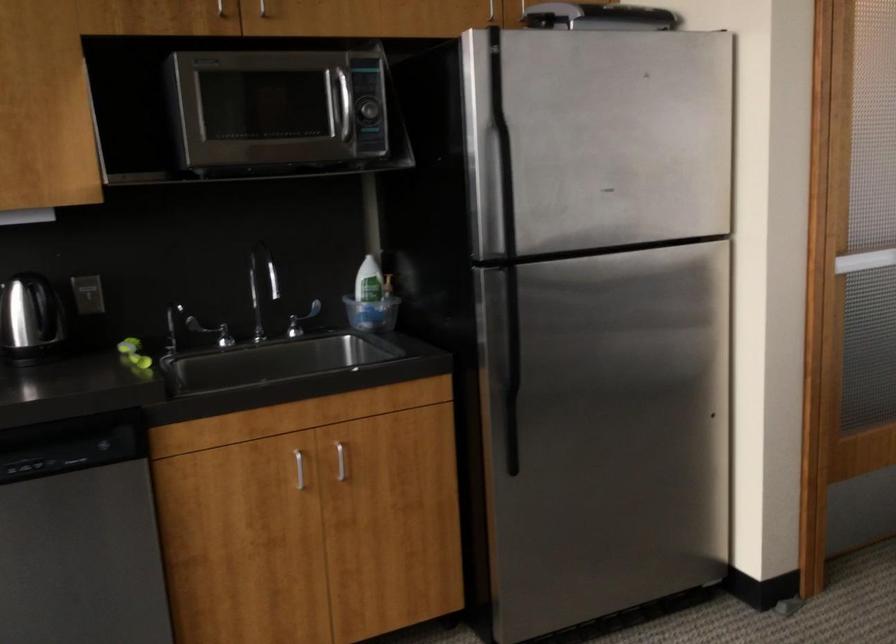
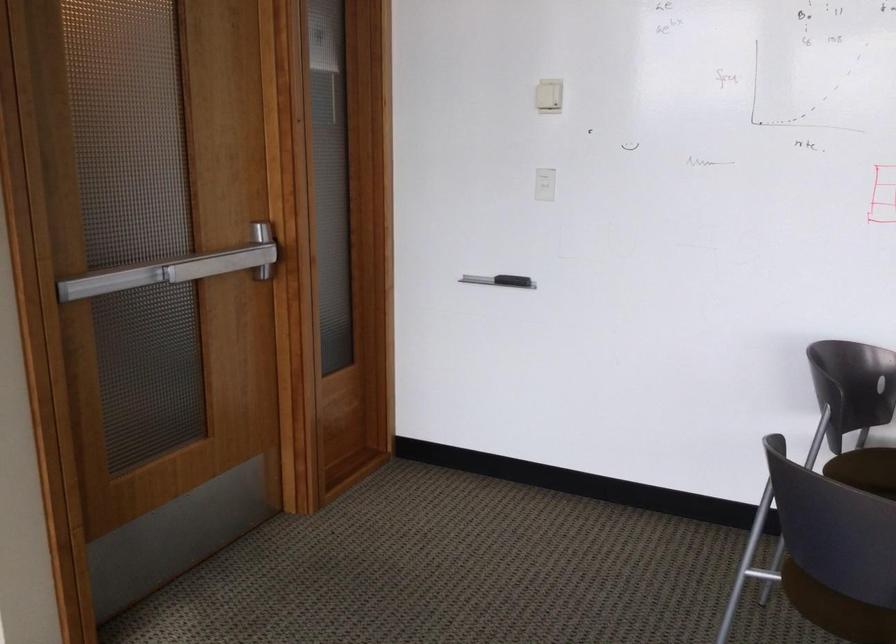
Question: The camera is either moving clockwise (left) or counter-clockwise (right) around the object. The first image is from the beginning of the video and the second image is from the end. Is the camera moving left or right when shooting the video?

Choices:
 (A) Left
 (B) Right

Answer: (A)